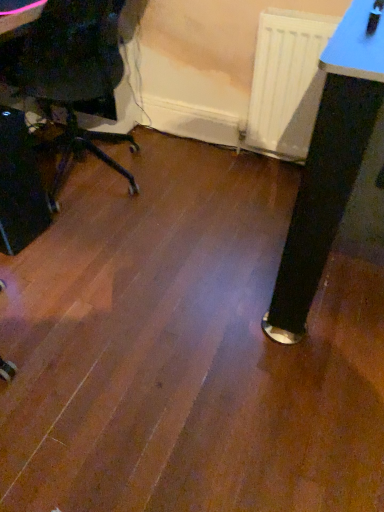
Locate an element on the screen. Image resolution: width=384 pixels, height=512 pixels. free point below white matte radiator at center (from a real-world perspective) is located at coordinates (269, 163).